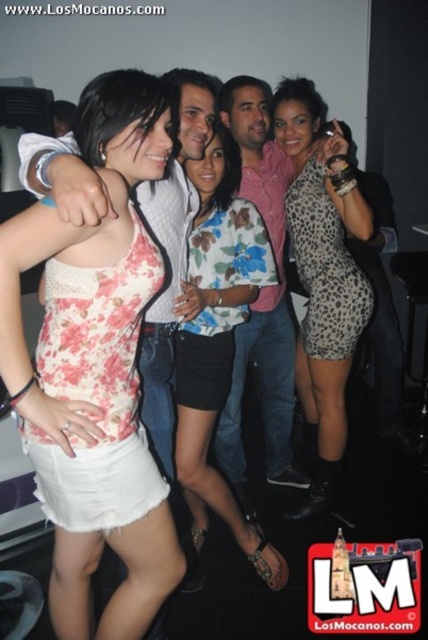
Question: Among these points, which one is nearest to the camera?

Choices:
 (A) (228, 172)
 (B) (76, 266)
 (C) (315, 173)
 (D) (226, 461)

Answer: (B)

Question: Does floral fabric tank top at center appear on the right side of floral fabric dress at center?

Choices:
 (A) no
 (B) yes

Answer: (A)

Question: Considering the real-world distances, which object is closest to the leopard print dress at center?

Choices:
 (A) pink cotton shirt at center
 (B) floral fabric tank top at center

Answer: (A)

Question: Does floral fabric dress at center have a smaller size compared to leopard print dress at center?

Choices:
 (A) no
 (B) yes

Answer: (B)

Question: Which object is positioned farthest from the leopard print dress at center?

Choices:
 (A) floral fabric tank top at center
 (B) pink cotton shirt at center

Answer: (A)

Question: Can you confirm if floral fabric dress at center is positioned above pink cotton shirt at center?

Choices:
 (A) no
 (B) yes

Answer: (A)